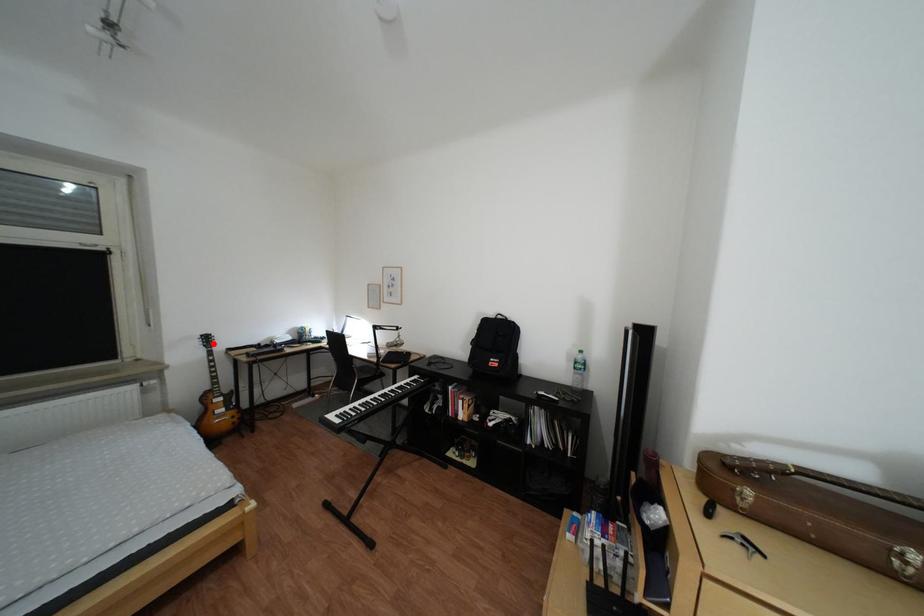
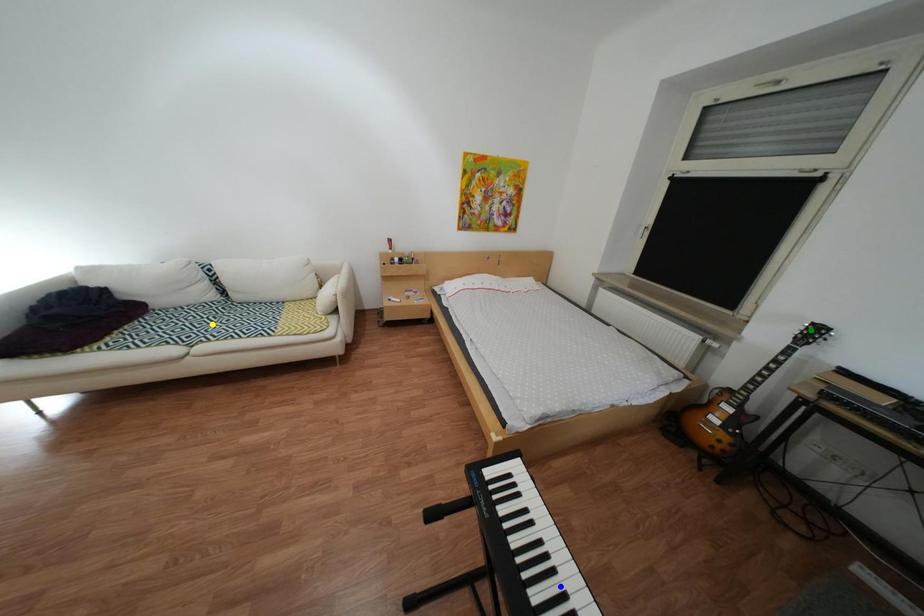
Question: I am providing you with two images of the same scene from different viewpoints. A red point is marked on the first image. You are given multiple points on the second image. Which spot in image 2 lines up with the point in image 1?

Choices:
 (A) green point
 (B) blue point
 (C) yellow point

Answer: (A)